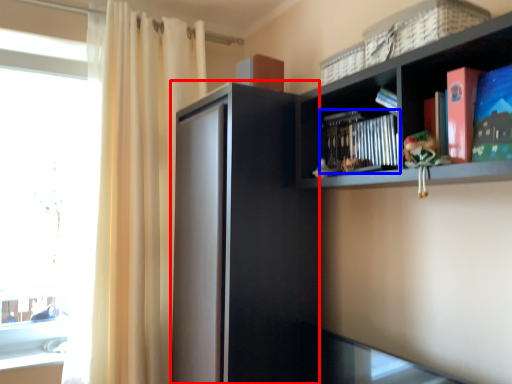
Question: Among these objects, which one is nearest to the camera, screen door (highlighted by a red box) or book (highlighted by a blue box)?

Choices:
 (A) screen door
 (B) book

Answer: (B)